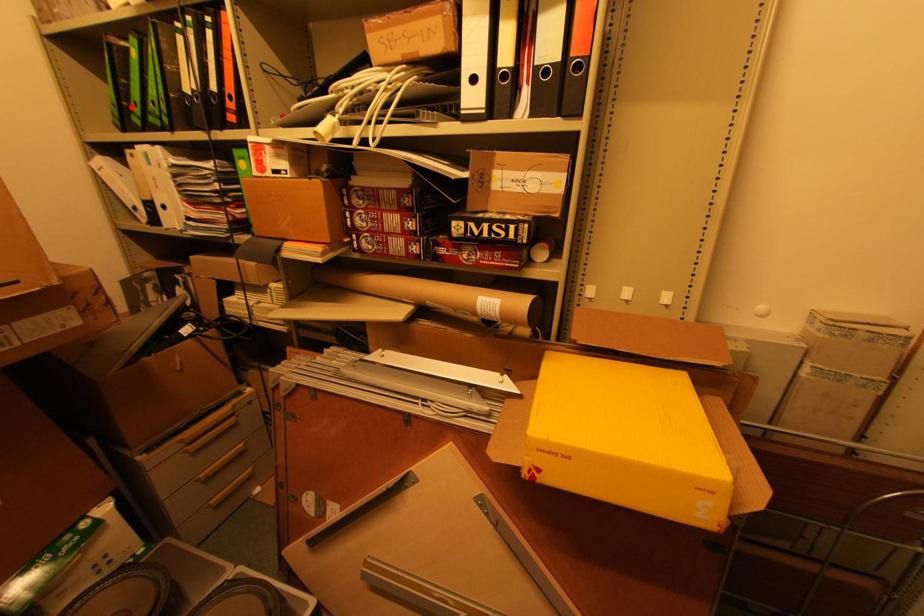
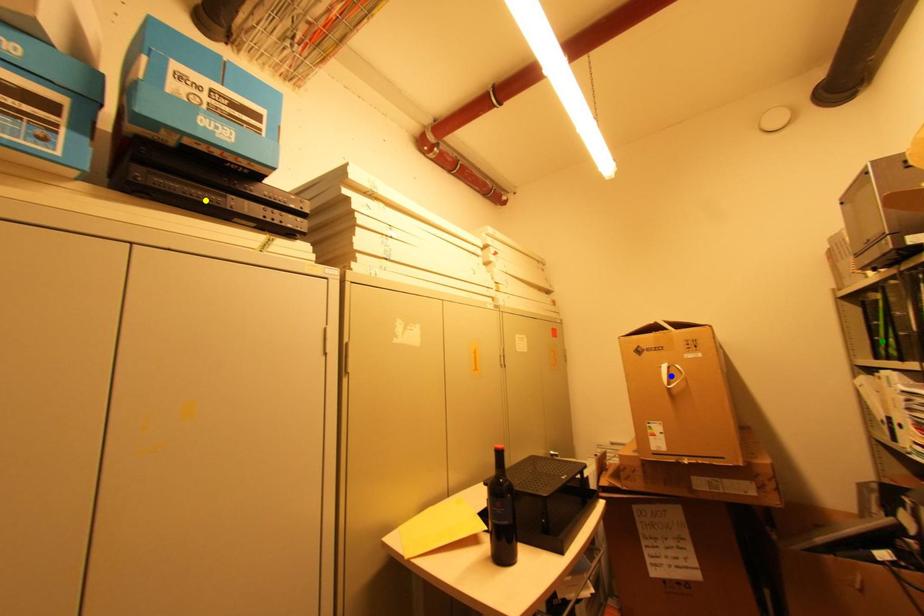
Question: I am providing you with two images of the same scene from different viewpoints. A red point is marked on the first image. You are given multiple points on the second image. In image 2, which mark is for the same physical point as the one in image 1?

Choices:
 (A) blue point
 (B) green point
 (C) yellow point

Answer: (B)